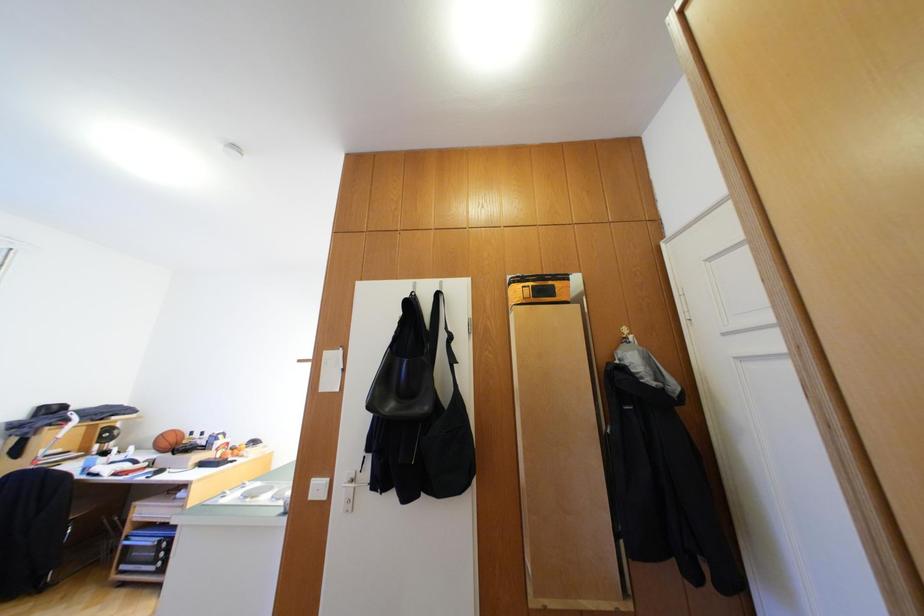
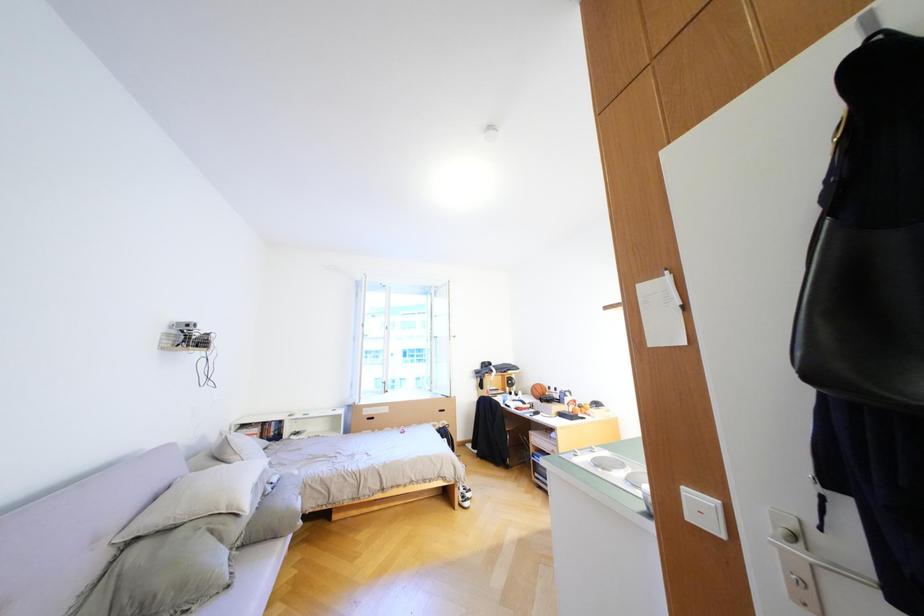
Question: The camera is either moving clockwise (left) or counter-clockwise (right) around the object. The first image is from the beginning of the video and the second image is from the end. Is the camera moving left or right when shooting the video?

Choices:
 (A) Left
 (B) Right

Answer: (B)